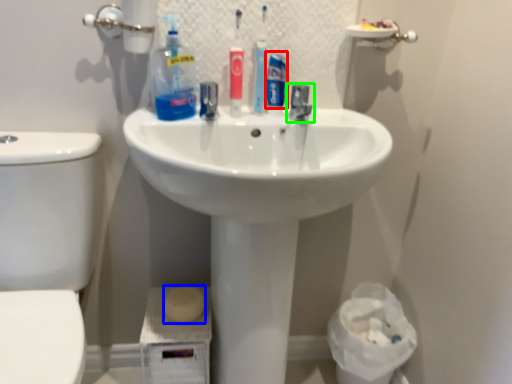
Question: Which object is the closest to the personal care (highlighted by a red box)? Choose among these: soap (highlighted by a blue box) or tap (highlighted by a green box).

Choices:
 (A) soap
 (B) tap

Answer: (B)